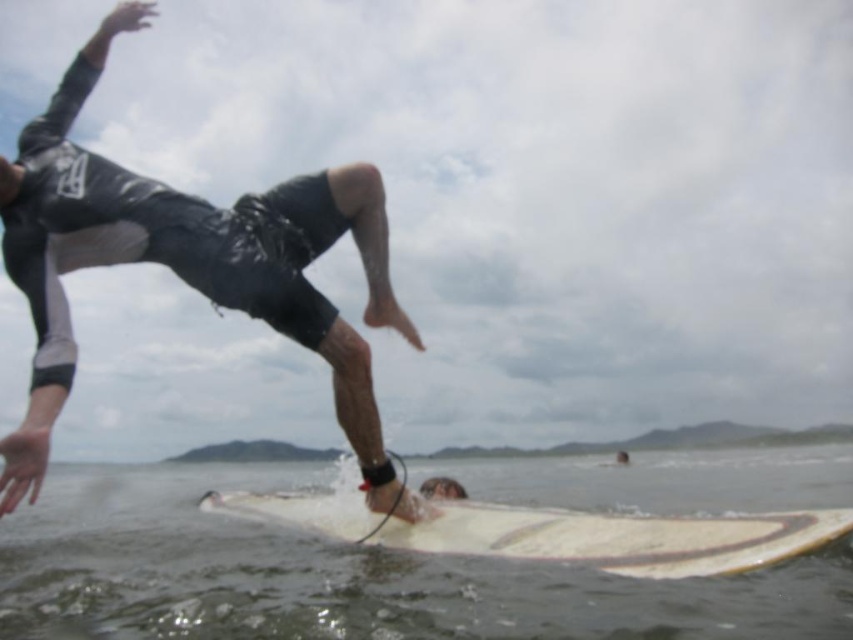
You are a photographer trying to capture the surfer in the image. The surfer is located at point (189,262). Can you confirm if this point is on the gray wetsuit surfer at left?

Yes, the point (189,262) corresponds to the gray wetsuit surfer at left.

You are a surfer trying to choose between two surfboards in the image. The white smooth surfboard at center and the white smooth surfboard at lower center. Which one is wider?

The white smooth surfboard at center is wider than the white smooth surfboard at lower center.